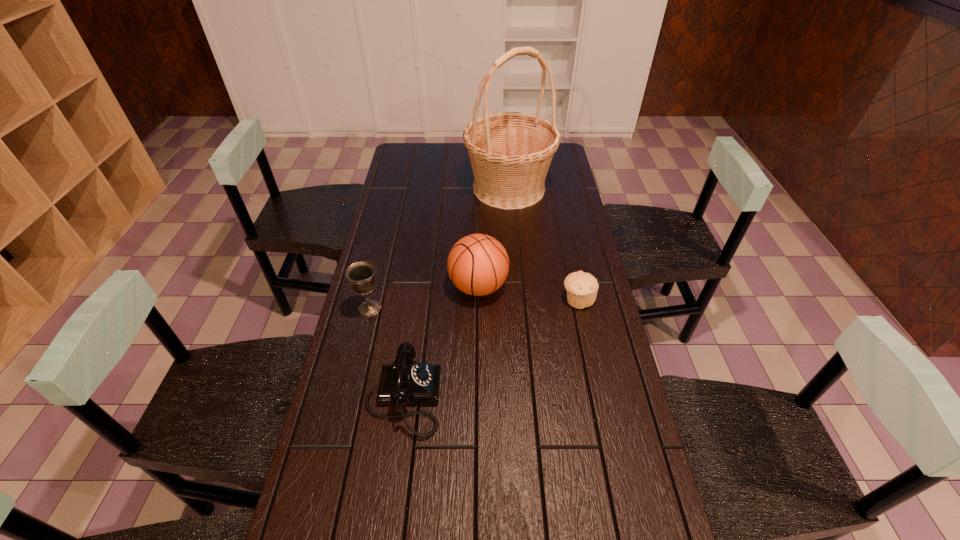
Where is `free point between the fourth shortest object and the muffin`? This screenshot has height=540, width=960. free point between the fourth shortest object and the muffin is located at coordinates point(528,293).

Where is `free space between the muffin and the basketball`? free space between the muffin and the basketball is located at coordinates (528, 293).

This screenshot has height=540, width=960. Find the location of `vacant space that's between the nearest object and the basket`. vacant space that's between the nearest object and the basket is located at coordinates (456, 293).

Identify which object is the third nearest to the second tallest object. Please provide its 2D coordinates. Your answer should be formatted as a tuple, i.e. [(x, y)], where the tuple contains the x and y coordinates of a point satisfying the conditions above.

[(360, 274)]

Identify the location of object that stands as the fourth closest to the basket. (405, 381).